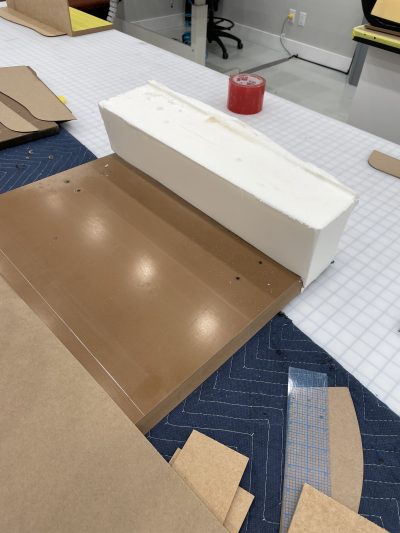
I want to click on wood product, so click(x=64, y=21).